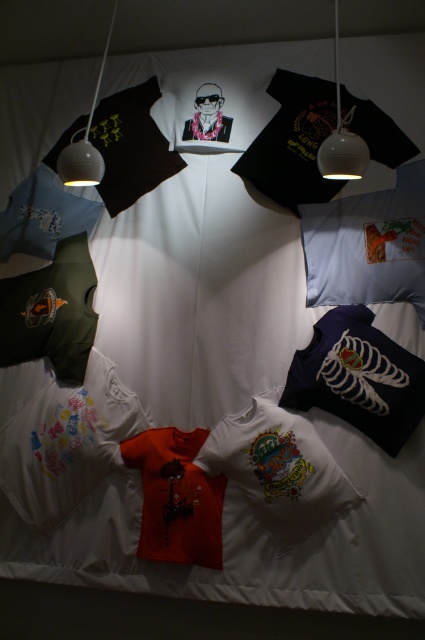
Question: Which point is farther to the camera?

Choices:
 (A) orange matte t-shirt at center
 (B) white soft pillow at lower left

Answer: (B)

Question: Does white soft pillow at lower left appear over navy blue fabric pillow at lower right?

Choices:
 (A) yes
 (B) no

Answer: (B)

Question: In this image, where is black matte pillow at upper left located relative to white glossy lamp at upper left?

Choices:
 (A) above
 (B) below

Answer: (A)

Question: Can you confirm if black matte pillow at upper left is positioned to the left of white matte pillow at center?

Choices:
 (A) no
 (B) yes

Answer: (B)

Question: Which point is closer to the camera?

Choices:
 (A) (396, 161)
 (B) (90, 458)
 (C) (243, 488)
 (D) (161, 154)

Answer: (C)

Question: Estimate the real-world distances between objects in this image. Which object is closer to the white cotton t-shirt at center?

Choices:
 (A) light blue fabric pillow at upper right
 (B) black matte pillow at upper left

Answer: (A)